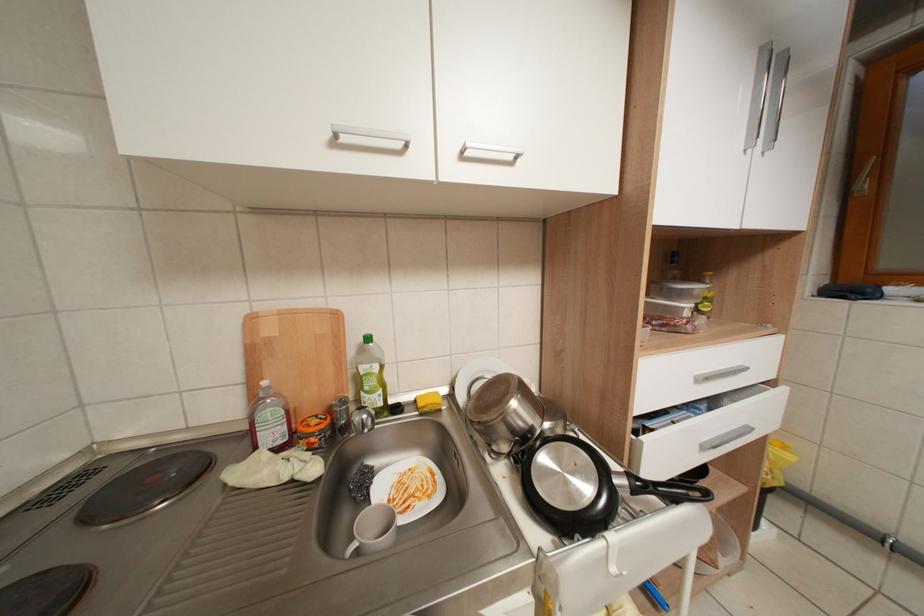
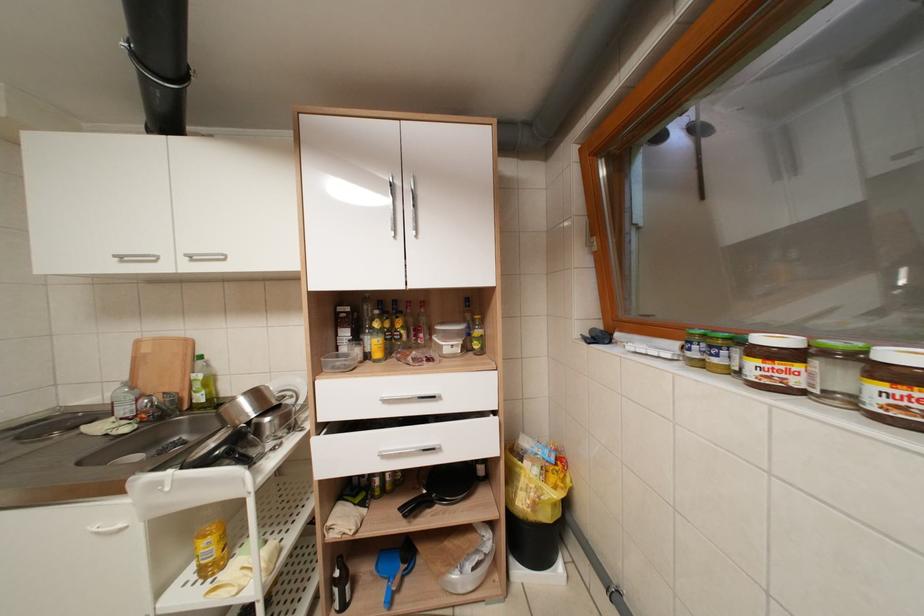
Question: The images are taken continuously from a first-person perspective. In which direction are you moving?

Choices:
 (A) Left
 (B) Right
 (C) Forward
 (D) Backward

Answer: (B)